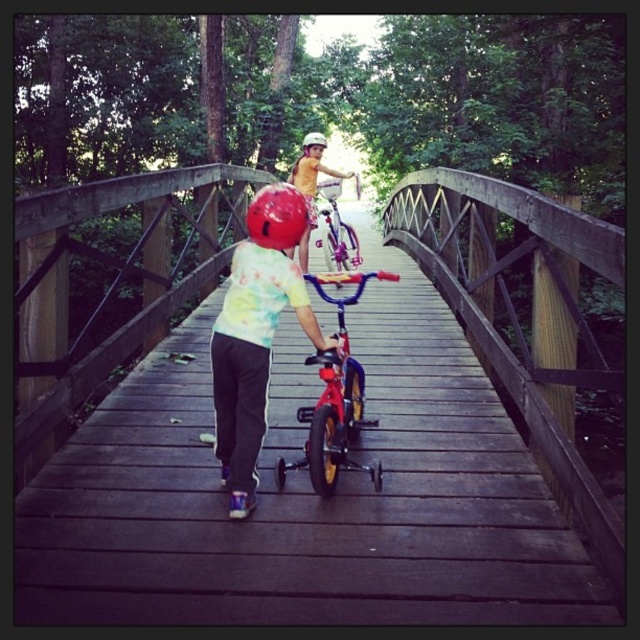
Can you confirm if rubber matte bicycle helmet at center is positioned below matte yellow shirt at center?

Indeed, rubber matte bicycle helmet at center is positioned under matte yellow shirt at center.

Find the location of `rubber matte bicycle helmet at center`. rubber matte bicycle helmet at center is located at coordinates (276, 216).

The image size is (640, 640). I want to click on rubber matte bicycle helmet at center, so click(x=276, y=216).

What are the coordinates of `rubber matte bicycle helmet at center` in the screenshot? It's located at (276, 216).

Between point (326, 460) and point (298, 250), which one is positioned in front?

Positioned in front is point (326, 460).

Is metallic blue bicycle at center positioned behind matte yellow shirt at center?

No, it is in front of matte yellow shirt at center.

Is point (333, 477) closer to camera compared to point (304, 189)?

Yes, point (333, 477) is in front of point (304, 189).

Where is `metallic blue bicycle at center`? metallic blue bicycle at center is located at coordinates (333, 397).

Is metallic purple bicycle at center above white matte helmet at upper center?

No.

Looking at this image, which of these two, metallic purple bicycle at center or white matte helmet at upper center, stands taller?

With more height is white matte helmet at upper center.

Who is more distant from viewer, (348, 230) or (316, 147)?

The point (348, 230) is more distant.

You are a GUI agent. You are given a task and a screenshot of the screen. Output one action in this format:
    pyautogui.click(x=<x>, y=<y>)
    Task: Click on the metallic purple bicycle at center
    This screenshot has height=640, width=640.
    Given the screenshot: What is the action you would take?
    pyautogui.click(x=337, y=230)